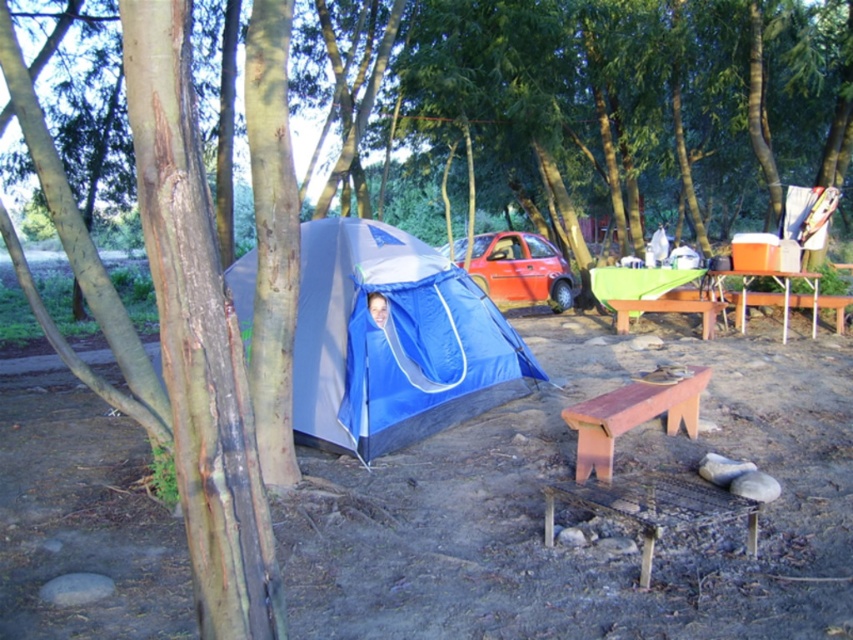
You are planning to set up a campfire between the blue tarpaulin tent at center and the orange plastic picnic table at right. Based on their positions, which side of the campfire should be closer to the picnic table?

The campfire should be placed between the blue tarpaulin tent at center and the orange plastic picnic table at right. Since the tent is to the left of the picnic table, the side of the campfire closer to the orange plastic picnic table at right would be its right side.

You are a camper who wants to sit on the brown wooden bench at lower center. To reach it, you need to walk from the orange plastic picnic table at right. Which direction should you move relative to the picnic table?

The brown wooden bench at lower center is located below the orange plastic picnic table at right, so you should move downward from the picnic table to reach the bench.

You are planning to set up a new tent in the woods. You have the blue tarpaulin tent at center and the orange plastic picnic table at right. Which object takes up more space in the camping area?

The blue tarpaulin tent at center is larger in size than the orange plastic picnic table at right, so it takes up more space in the camping area.